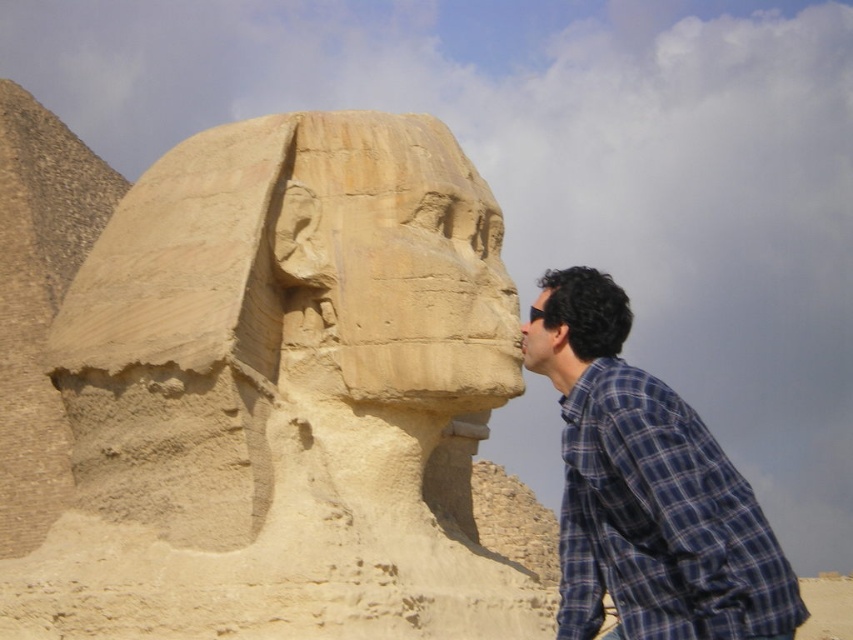
Question: Among these objects, which one is nearest to the camera?

Choices:
 (A) matte stone nose at center
 (B) blue plaid shirt at right

Answer: (B)

Question: Is matte brown hair at right positioned in front of matte stone nose at center?

Choices:
 (A) yes
 (B) no

Answer: (A)

Question: Among these objects, which one is nearest to the camera?

Choices:
 (A) blue plaid shirt at right
 (B) sandstone statue at center

Answer: (A)

Question: Is sandstone statue at center above matte stone nose at center?

Choices:
 (A) yes
 (B) no

Answer: (B)

Question: In this image, where is matte brown hair at right located relative to matte stone nose at center?

Choices:
 (A) right
 (B) left

Answer: (A)

Question: Which of the following is the closest to the observer?

Choices:
 (A) matte stone nose at center
 (B) sandstone statue at center
 (C) blue plaid shirt at right

Answer: (C)